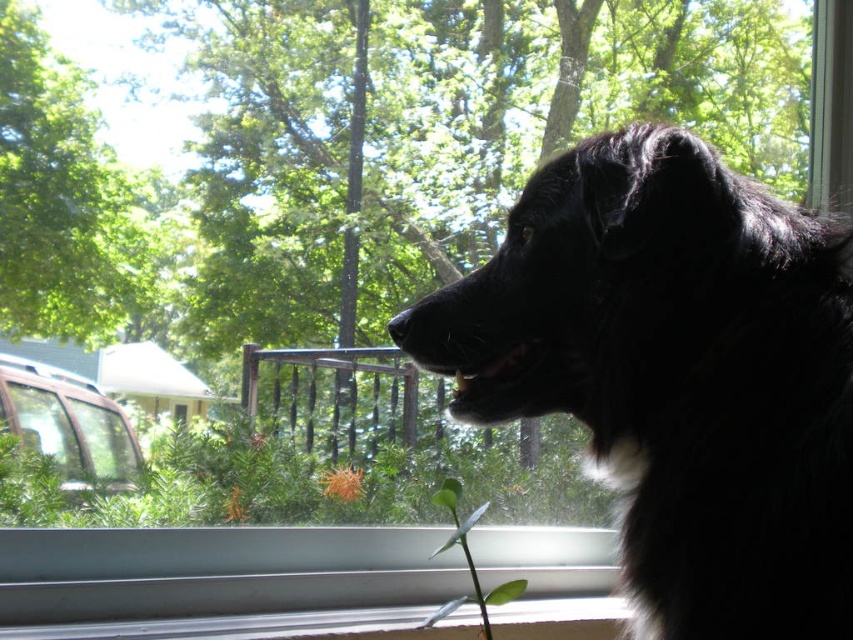
Question: Is black fluffy dog at upper right thinner than green leafy stem at lower center?

Choices:
 (A) no
 (B) yes

Answer: (A)

Question: Which object is closer to the camera taking this photo?

Choices:
 (A) green leafy stem at lower center
 (B) green leafy tree at upper left
 (C) black fluffy dog at upper right

Answer: (C)

Question: Does black fluffy dog at upper right have a smaller size compared to green leafy tree at upper left?

Choices:
 (A) yes
 (B) no

Answer: (B)

Question: Can you confirm if black fluffy dog at upper right is thinner than green leafy tree at upper left?

Choices:
 (A) yes
 (B) no

Answer: (B)

Question: Which object appears closest to the camera in this image?

Choices:
 (A) black fluffy dog at upper right
 (B) green leafy stem at lower center
 (C) green leafy tree at upper left

Answer: (A)

Question: Which point is farther to the camera?

Choices:
 (A) green leafy stem at lower center
 (B) green leafy tree at upper left

Answer: (B)